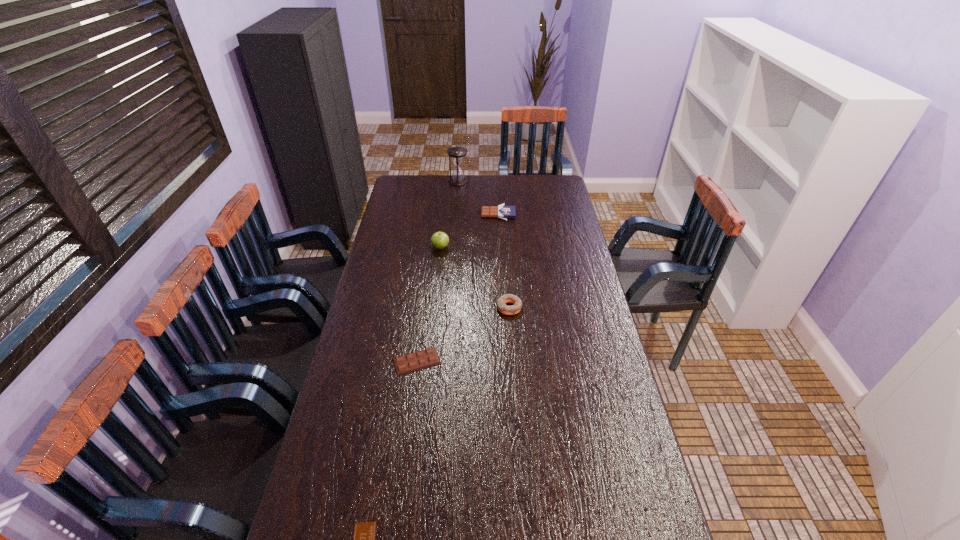
Find the location of a particular element. The height and width of the screenshot is (540, 960). vacant area between the fourth farthest object and the third shortest object is located at coordinates (504, 261).

What are the coordinates of `free space between the rightmost chocolate bar and the apple` in the screenshot? It's located at (469, 231).

The width and height of the screenshot is (960, 540). I want to click on empty location between the tallest chocolate bar and the hourglass, so click(478, 198).

Identify the location of vacant space in between the apple and the fifth farthest object. (428, 305).

Locate an element on the screen. This screenshot has width=960, height=540. free point between the hourglass and the doughnut is located at coordinates pyautogui.click(x=484, y=244).

Find the location of `free area in between the tallest object and the third tallest object`. free area in between the tallest object and the third tallest object is located at coordinates (484, 244).

At what (x,y) coordinates should I click in order to perform the action: click on the fourth closest object to the second nearest object. Please return your answer as a coordinate pair (x, y). The height and width of the screenshot is (540, 960). Looking at the image, I should click on (503, 212).

Identify which object is located as the fourth nearest to the farthest object. Please provide its 2D coordinates. Your answer should be formatted as a tuple, i.e. [(x, y)], where the tuple contains the x and y coordinates of a point satisfying the conditions above.

[(422, 359)]

Point out which chocolate bar is positioned as the nearest to the second shortest object. Please provide its 2D coordinates. Your answer should be formatted as a tuple, i.e. [(x, y)], where the tuple contains the x and y coordinates of a point satisfying the conditions above.

[(364, 533)]

Locate an element on the screen. The width and height of the screenshot is (960, 540). chocolate bar that stands as the closest to the fourth tallest object is located at coordinates (422, 359).